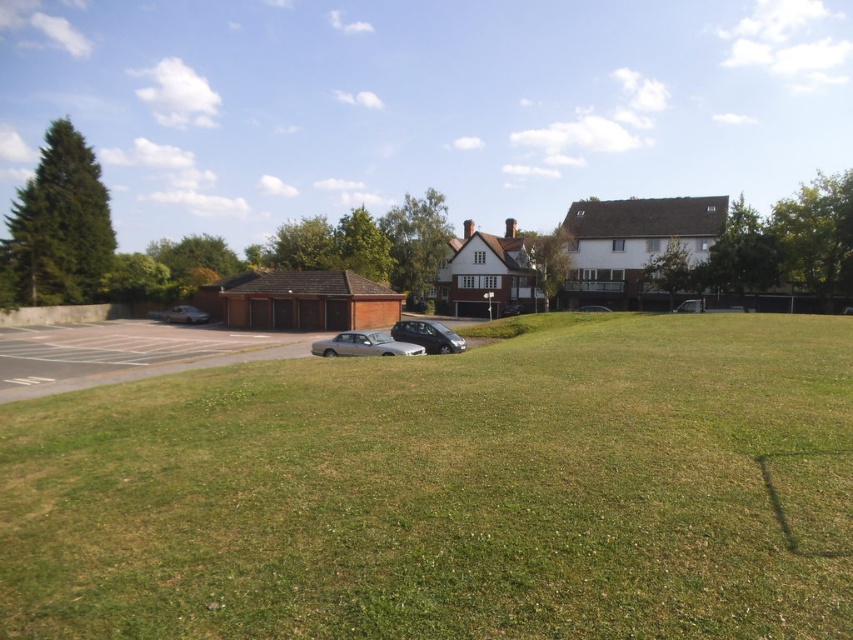
Is green grass at lower center smaller than silver metallic car at center?

No.

From the picture: Does green grass at lower center have a lesser width compared to silver metallic car at center?

In fact, green grass at lower center might be wider than silver metallic car at center.

Image resolution: width=853 pixels, height=640 pixels. I want to click on green grass at lower center, so click(x=450, y=492).

Identify the location of green grass at lower center. (450, 492).

Between satin silver car at center and metallic silver car at center, which one is positioned higher?

Positioned higher is metallic silver car at center.

Does satin silver car at center have a larger size compared to metallic silver car at center?

Indeed, satin silver car at center has a larger size compared to metallic silver car at center.

Which is in front, point (412, 340) or point (689, 301)?

Point (412, 340)

Where is `satin silver car at center`? The image size is (853, 640). satin silver car at center is located at coordinates pyautogui.click(x=428, y=336).

Who is shorter, silver metallic car at center or metallic silver car at left?

Standing shorter between the two is silver metallic car at center.

Where is `silver metallic car at center`? The width and height of the screenshot is (853, 640). silver metallic car at center is located at coordinates (364, 344).

Where is `silver metallic car at center`? This screenshot has height=640, width=853. silver metallic car at center is located at coordinates (364, 344).